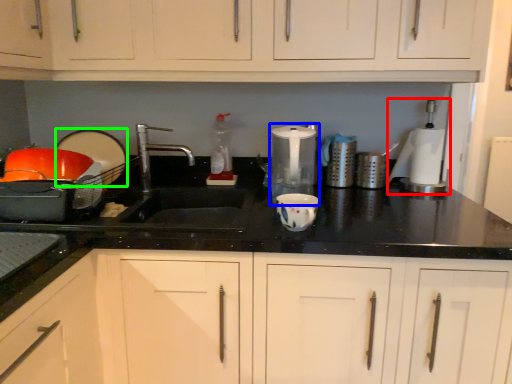
Question: Considering the real-world distances, which object is farthest from blender (highlighted by a red box)? appliance (highlighted by a blue box) or appliance (highlighted by a green box)?

Choices:
 (A) appliance
 (B) appliance

Answer: (B)